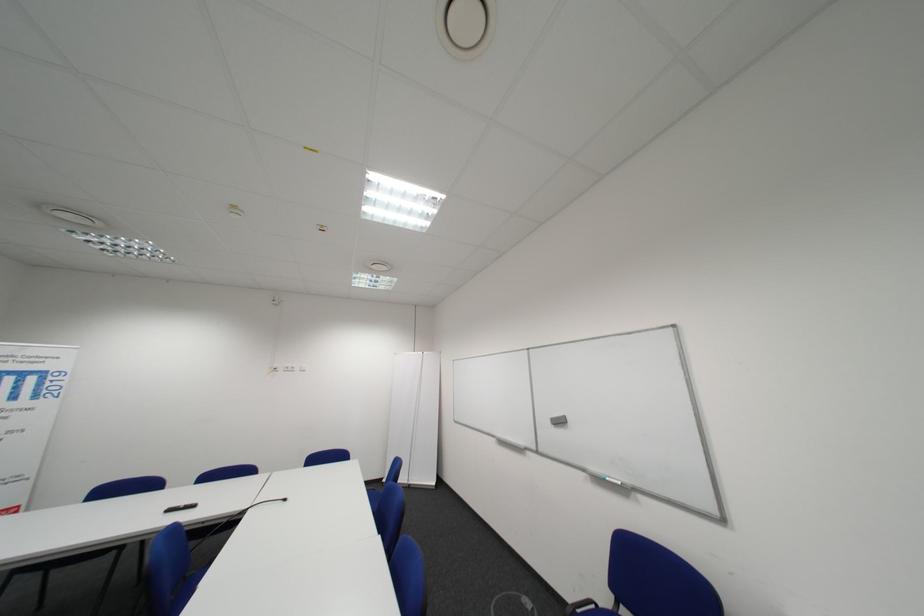
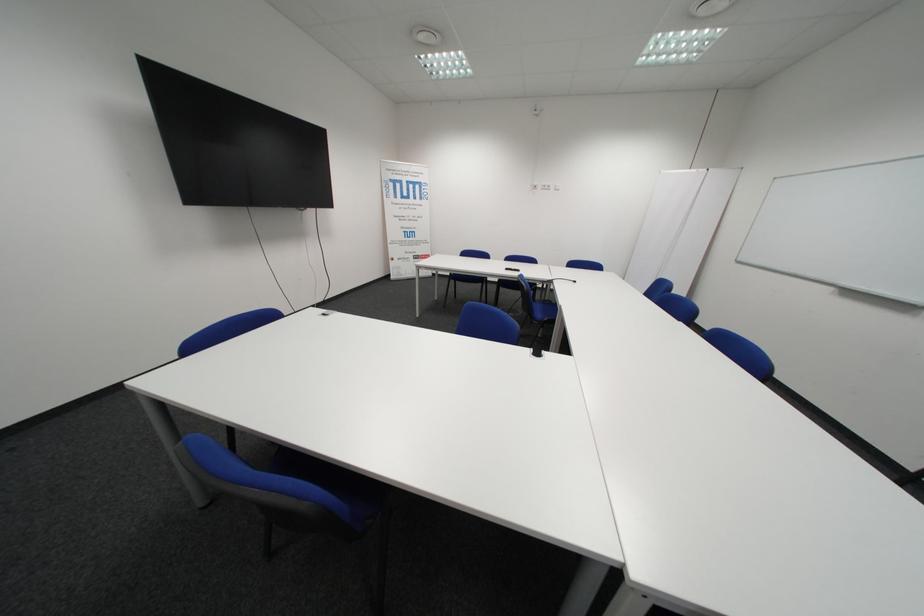
The first image is from the beginning of the video and the second image is from the end. How did the camera likely rotate when shooting the video?

The camera rotated toward left-down.